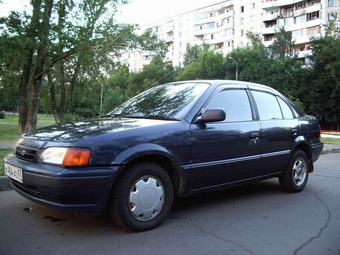
Identify the location of glass. This screenshot has width=340, height=255. (174, 102), (229, 100), (274, 97), (289, 108), (299, 114).